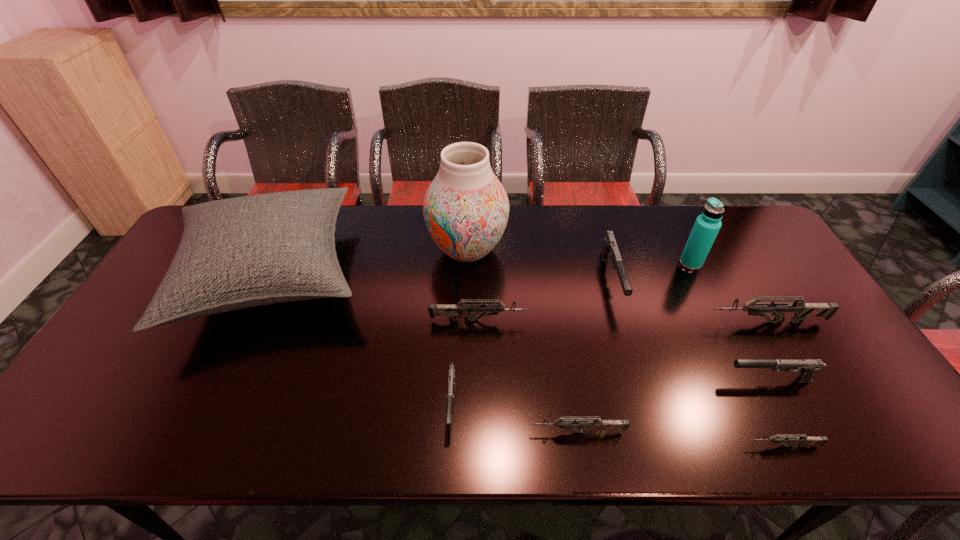
Identify the location of free location located at the muzzle end of the rightmost gray gun. (697, 380).

Find the location of a particular element. Image resolution: width=960 pixels, height=540 pixels. free space located at the muzzle end of the rightmost gray gun is located at coordinates (692, 380).

Locate an element on the screen. Image resolution: width=960 pixels, height=540 pixels. vacant space positioned 0.130m at the muzzle end of the rightmost gray gun is located at coordinates (672, 380).

This screenshot has height=540, width=960. I want to click on free region located aimed along the barrel of the second nearest grey gun, so click(x=392, y=433).

Find the location of `free location located 0.260m aimed along the barrel of the second nearest grey gun`. free location located 0.260m aimed along the barrel of the second nearest grey gun is located at coordinates (414, 433).

I want to click on free point located aimed along the barrel of the second nearest grey gun, so click(x=449, y=433).

Locate an element on the screen. vacant space positioned 0.250m aimed along the barrel of the shortest gun is located at coordinates (632, 446).

Where is `free space located 0.220m aimed along the barrel of the shortest gun`? The height and width of the screenshot is (540, 960). free space located 0.220m aimed along the barrel of the shortest gun is located at coordinates (646, 446).

Locate an element on the screen. The image size is (960, 540). vacant space located 0.350m aimed along the barrel of the shortest gun is located at coordinates (587, 446).

Find the location of `vase that is at the far edge`. vase that is at the far edge is located at coordinates (466, 208).